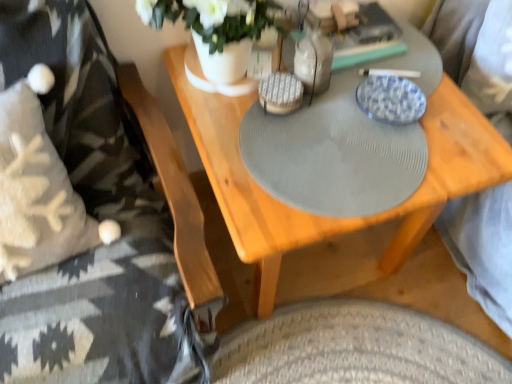
Image resolution: width=512 pixels, height=384 pixels. I want to click on free point to the right of clear glass bottle at center, so click(x=385, y=93).